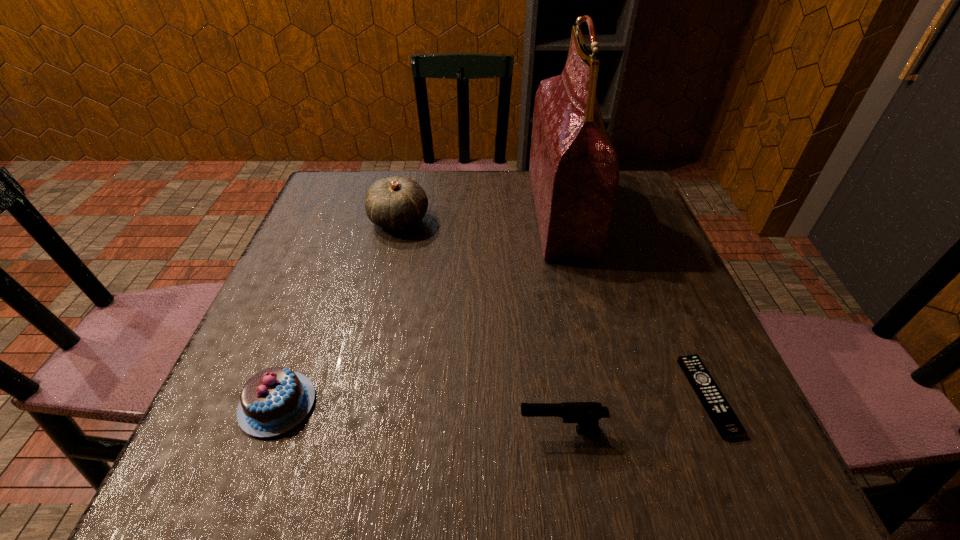
The width and height of the screenshot is (960, 540). I want to click on free space located 0.320m on the front-facing side of the pistol, so click(x=311, y=430).

The width and height of the screenshot is (960, 540). I want to click on blank space located 0.400m on the front-facing side of the pistol, so tap(260, 430).

Where is `free space located on the front-facing side of the pistol`? The height and width of the screenshot is (540, 960). free space located on the front-facing side of the pistol is located at coordinates (460, 430).

Locate an element on the screen. The image size is (960, 540). vacant space located 0.110m on the right of the chocolate cake is located at coordinates (383, 404).

At what (x,y) coordinates should I click in order to perform the action: click on vacant space located 0.330m on the left of the rightmost object. Please return your answer as a coordinate pair (x, y). Looking at the image, I should click on (491, 396).

This screenshot has height=540, width=960. Identify the location of handbag situated at the far edge. (574, 171).

Find the location of `gourd that is positioned at the far edge`. gourd that is positioned at the far edge is located at coordinates (396, 203).

The height and width of the screenshot is (540, 960). In order to click on pistol present at the near edge in this screenshot , I will do pos(586,414).

Find the location of `chocolate cake that is positioned at the near edge`. chocolate cake that is positioned at the near edge is located at coordinates (275, 400).

Where is `remote control at the near edge`? remote control at the near edge is located at coordinates (728, 425).